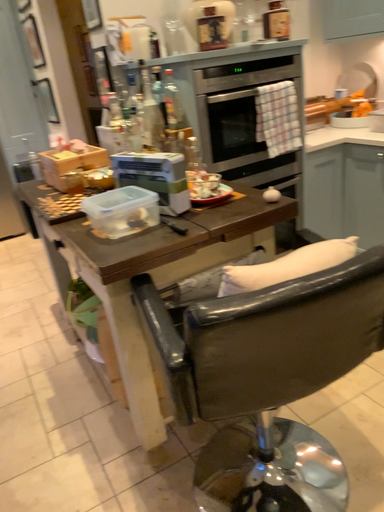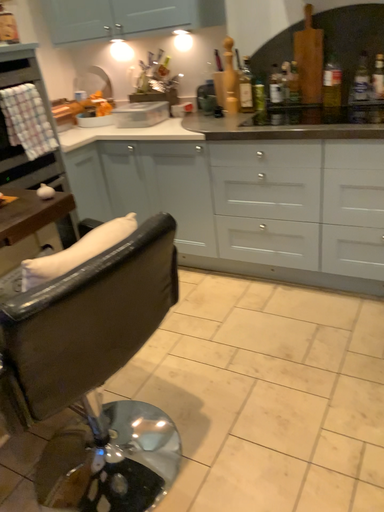
Question: Which way did the camera rotate in the video?

Choices:
 (A) rotated left
 (B) rotated right

Answer: (B)